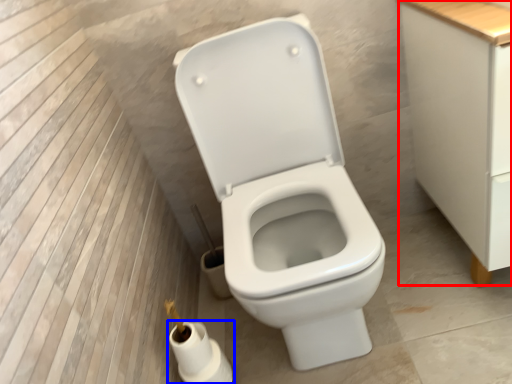
Question: Which object appears closest to the camera in this image, cabinetry (highlighted by a red box) or toilet paper (highlighted by a blue box)?

Choices:
 (A) cabinetry
 (B) toilet paper

Answer: (A)